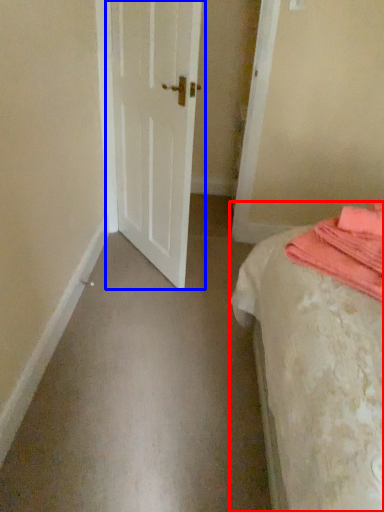
Question: Which of the following is the closest to the observer, bed (highlighted by a red box) or door (highlighted by a blue box)?

Choices:
 (A) bed
 (B) door

Answer: (A)